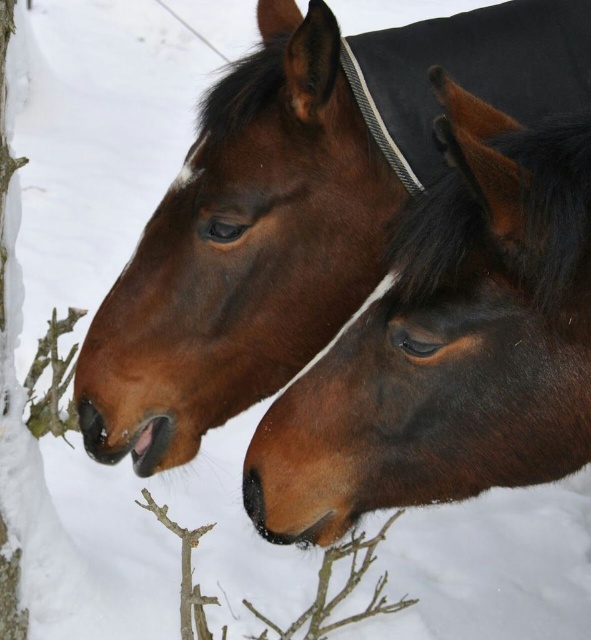
Question: Which object is farther from the camera taking this photo?

Choices:
 (A) brown glossy horse at center
 (B) brown woody branch at lower center

Answer: (B)

Question: Which of the following is the farthest from the observer?

Choices:
 (A) (203, 595)
 (B) (563, 262)

Answer: (A)

Question: Is brown glossy horse at center bigger than brown woody branch at lower center?

Choices:
 (A) no
 (B) yes

Answer: (A)

Question: Is brown glossy horse at center smaller than brown woody branch at lower center?

Choices:
 (A) yes
 (B) no

Answer: (A)

Question: In this image, where is brown glossy horse at center located relative to brown woody branch at lower center?

Choices:
 (A) above
 (B) below

Answer: (A)

Question: Which point appears farthest from the camera in this image?

Choices:
 (A) (577, 344)
 (B) (397, 605)

Answer: (B)